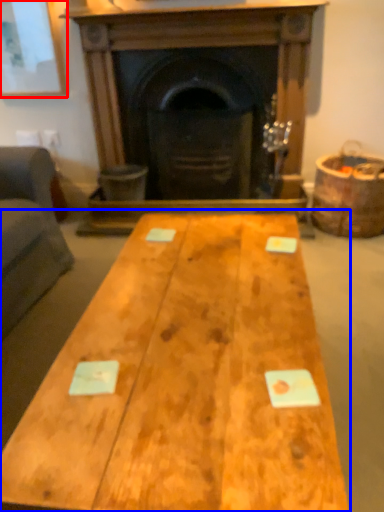
Question: Which object appears closest to the camera in this image, picture frame (highlighted by a red box) or table (highlighted by a blue box)?

Choices:
 (A) picture frame
 (B) table

Answer: (B)